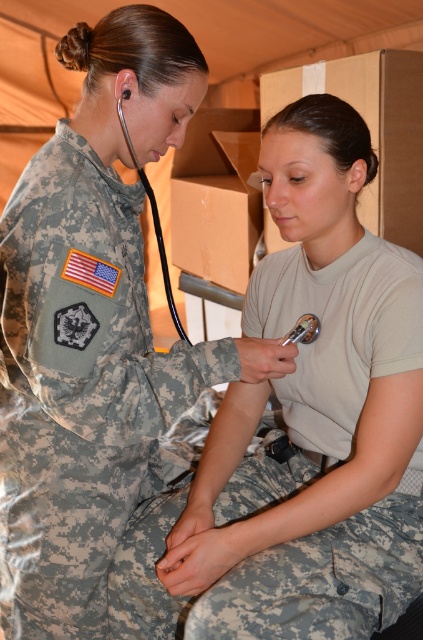
Does point (203, 369) come closer to viewer compared to point (269, 486)?

Yes, point (203, 369) is closer to viewer.

Between point (66, 342) and point (266, 588), which one is positioned behind?

The point (266, 588) is behind.

At what (x,y) coordinates should I click in order to perform the action: click on camouflage fabric uniform at upper left. Please return your answer as a coordinate pair (x, y). Looking at the image, I should click on (79, 387).